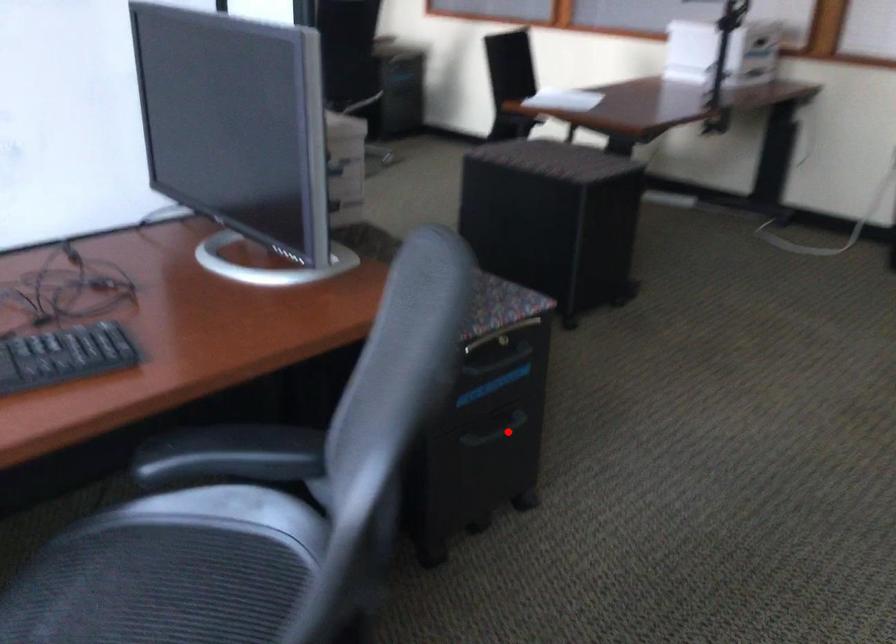
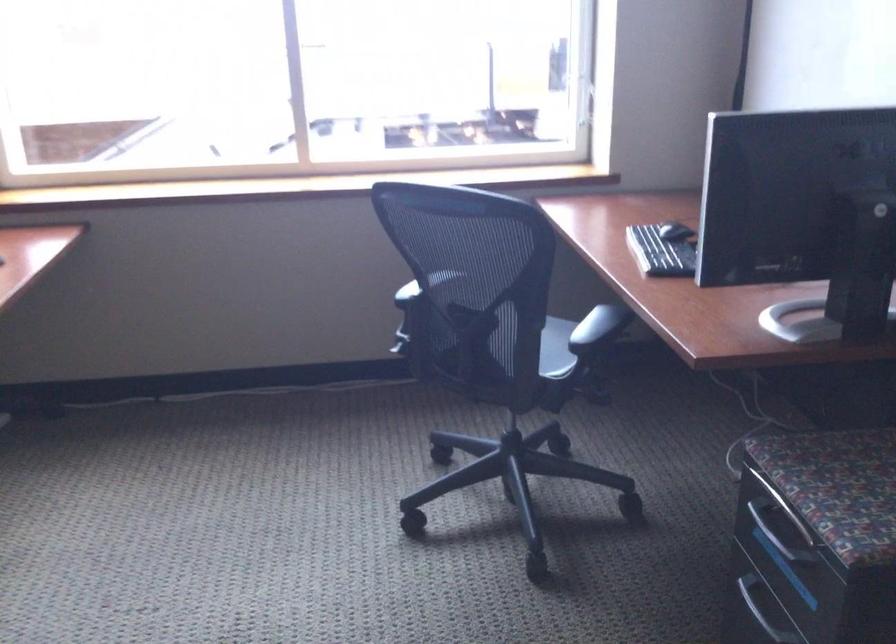
Question: I am providing you with two images of the same scene from different viewpoints. Given a red point in image1, look at the same physical point in image2. Is it:

Choices:
 (A) Closer to the viewpoint
 (B) Farther from the viewpoint

Answer: (A)